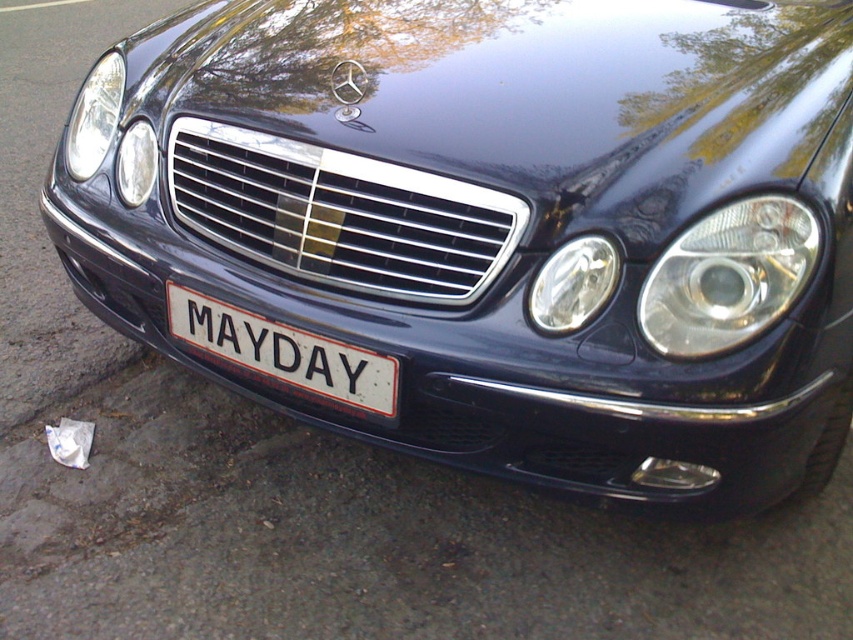
You are a parking assistant trying to align your car with the Mercedes in the image. You notice the white matte license plate at center and the matte black headlight at left. Which object is closer to you as you approach the front of the car?

The white matte license plate at center is closer to you because it is in front of the matte black headlight at left.